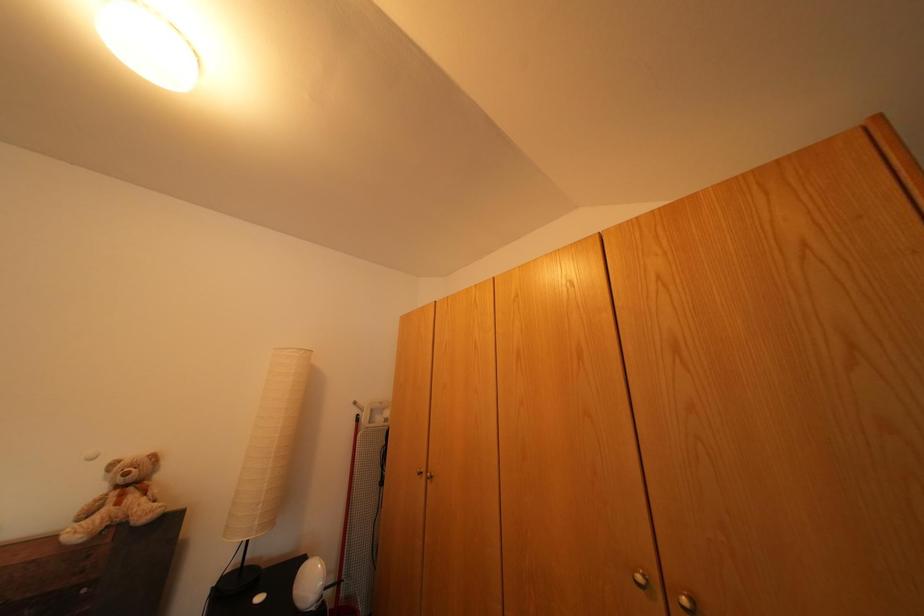
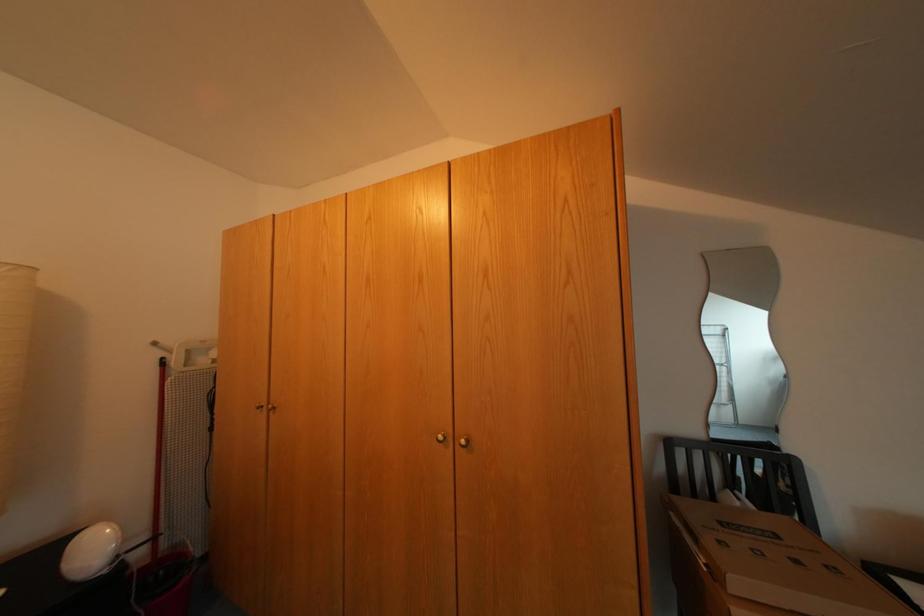
Question: The camera is either moving clockwise (left) or counter-clockwise (right) around the object. The first image is from the beginning of the video and the second image is from the end. Is the camera moving left or right when shooting the video?

Choices:
 (A) Left
 (B) Right

Answer: (A)